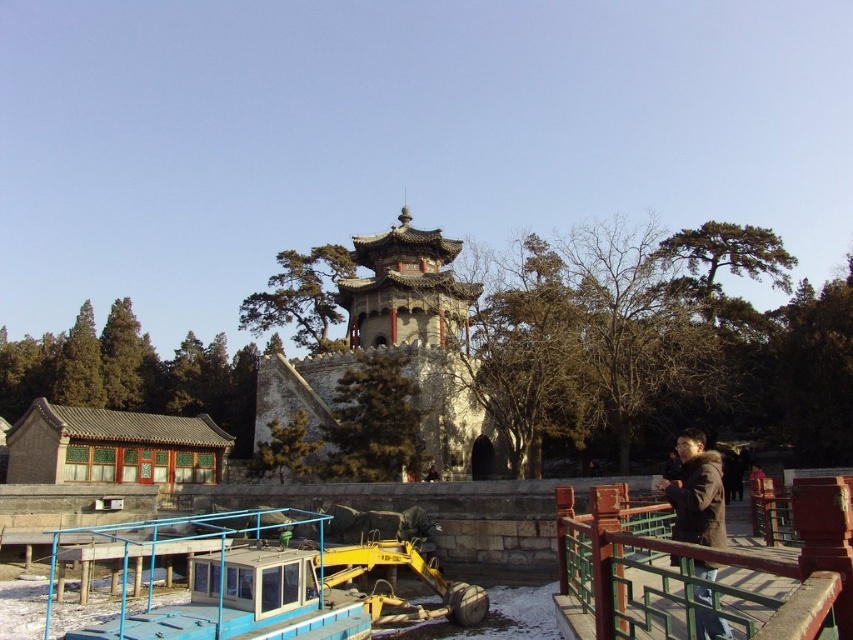
Question: Which object appears farthest from the camera in this image?

Choices:
 (A) stone textured pagoda at center
 (B) brown fuzzy jacket at lower right

Answer: (A)

Question: Can you confirm if green painted wood bridge at lower right is wider than stone textured pagoda at center?

Choices:
 (A) yes
 (B) no

Answer: (B)

Question: Observing the image, what is the correct spatial positioning of green painted wood bridge at lower right in reference to brown fuzzy jacket at lower right?

Choices:
 (A) right
 (B) left

Answer: (B)

Question: Can you confirm if stone textured pagoda at center is positioned above brown fuzzy jacket at lower right?

Choices:
 (A) yes
 (B) no

Answer: (A)

Question: Which object is positioned farthest from the brown fuzzy jacket at lower right?

Choices:
 (A) stone textured pagoda at center
 (B) green painted wood bridge at lower right

Answer: (A)

Question: Estimate the real-world distances between objects in this image. Which object is farther from the green painted wood bridge at lower right?

Choices:
 (A) brown fuzzy jacket at lower right
 (B) stone textured pagoda at center

Answer: (B)